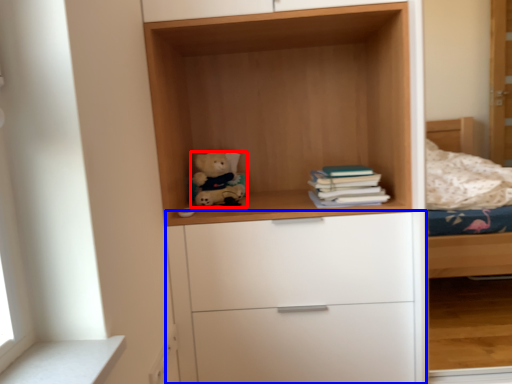
Question: Which object is further to the camera taking this photo, teddy bear (highlighted by a red box) or chest of drawers (highlighted by a blue box)?

Choices:
 (A) teddy bear
 (B) chest of drawers

Answer: (A)